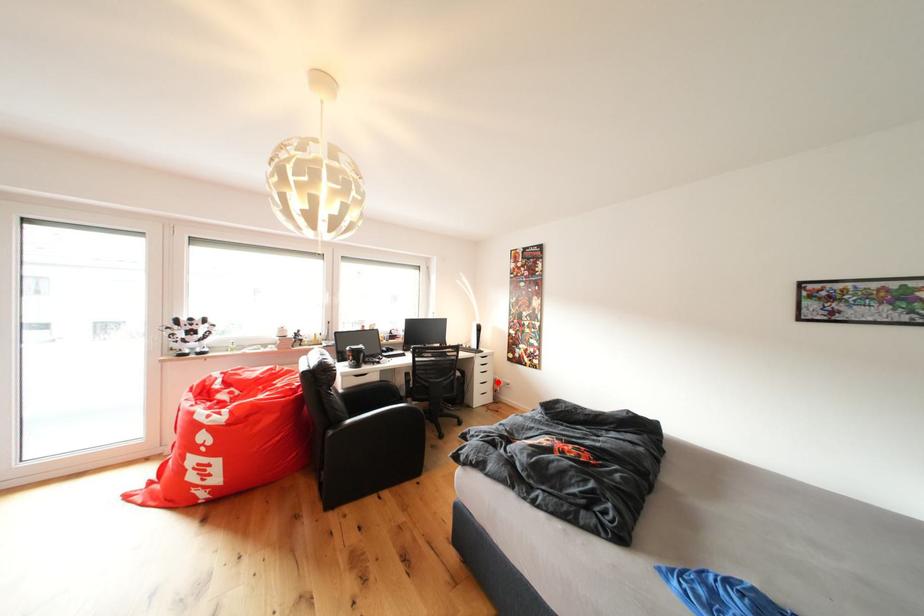
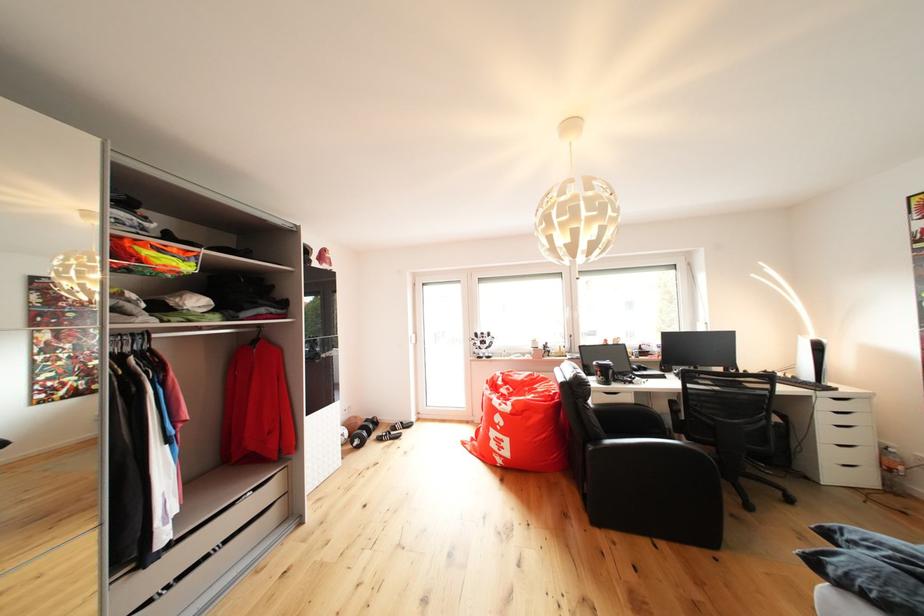
Question: I am providing you with two images of the same scene from different viewpoints. Given a red point in image1, look at the same physical point in image2. Is it:

Choices:
 (A) Closer to the viewpoint
 (B) Farther from the viewpoint

Answer: (B)